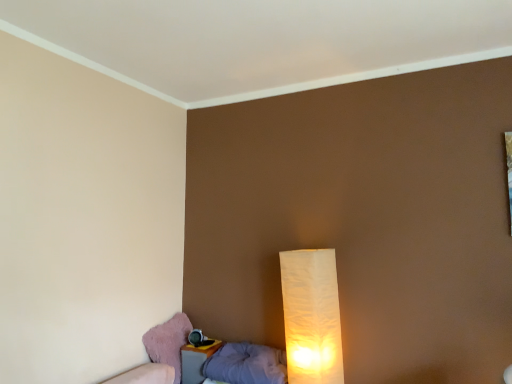
The width and height of the screenshot is (512, 384). What do you see at coordinates (168, 342) in the screenshot?
I see `pink fabric swivel chair at lower left` at bounding box center [168, 342].

This screenshot has width=512, height=384. What do you see at coordinates (311, 316) in the screenshot? I see `white paper lamp at lower right` at bounding box center [311, 316].

What are the coordinates of `gray fabric pillow at lower left` in the screenshot? It's located at (246, 364).

At what (x,y) coordinates should I click in order to perform the action: click on matte plastic nightstand at lower left. Please return your answer as a coordinate pair (x, y). Looking at the image, I should click on (196, 361).

Is pink fabric swivel chair at lower left positioned far away from white paper lamp at lower right?

No, pink fabric swivel chair at lower left is in close proximity to white paper lamp at lower right.

Does pink fabric swivel chair at lower left lie behind white paper lamp at lower right?

Yes, pink fabric swivel chair at lower left is further from the viewer.

Can you confirm if pink fabric swivel chair at lower left is bigger than white paper lamp at lower right?

No.

Is point (160, 356) closer or farther from the camera than point (286, 379)?

Clearly, point (160, 356) is more distant from the camera than point (286, 379).

Which of these two, pink fabric swivel chair at lower left or gray fabric pillow at lower left, is bigger?

Bigger between the two is gray fabric pillow at lower left.

Is pink fabric swivel chair at lower left positioned behind gray fabric pillow at lower left?

Yes, it is behind gray fabric pillow at lower left.

Considering the relative sizes of pink fabric swivel chair at lower left and gray fabric pillow at lower left in the image provided, is pink fabric swivel chair at lower left taller than gray fabric pillow at lower left?

Yes.

Which is less distant, (176, 348) or (197, 379)?

Point (176, 348).

Between pink fabric swivel chair at lower left and matte plastic nightstand at lower left, which one has larger width?

Wider between the two is pink fabric swivel chair at lower left.

Is matte plastic nightstand at lower left located within pink fabric swivel chair at lower left?

No, pink fabric swivel chair at lower left does not contain matte plastic nightstand at lower left.

Considering the relative sizes of pink fabric swivel chair at lower left and matte plastic nightstand at lower left in the image provided, is pink fabric swivel chair at lower left bigger than matte plastic nightstand at lower left?

Indeed, pink fabric swivel chair at lower left has a larger size compared to matte plastic nightstand at lower left.

This screenshot has height=384, width=512. Identify the location of swivel chair that appears below the white paper lamp at lower right (from a real-world perspective). (168, 342).

Is white paper lamp at lower right wider than pink fabric swivel chair at lower left?

No, white paper lamp at lower right is not wider than pink fabric swivel chair at lower left.

Consider the image. In the image, is white paper lamp at lower right positioned in front of or behind pink fabric swivel chair at lower left?

Clearly, white paper lamp at lower right is in front of pink fabric swivel chair at lower left.

Between matte plastic nightstand at lower left and gray fabric pillow at lower left, which one is positioned in front?

gray fabric pillow at lower left is in front.

From the image's perspective, would you say matte plastic nightstand at lower left is positioned over gray fabric pillow at lower left?

No, from the image's perspective, matte plastic nightstand at lower left is not above gray fabric pillow at lower left.

Is matte plastic nightstand at lower left oriented away from gray fabric pillow at lower left?

No.

Is gray fabric pillow at lower left looking in the opposite direction of white paper lamp at lower right?

gray fabric pillow at lower left does not have its back to white paper lamp at lower right.

Between point (275, 381) and point (280, 261), which one is positioned in front?

Point (275, 381)

Where is `pillow that is behind the white paper lamp at lower right`? Image resolution: width=512 pixels, height=384 pixels. pillow that is behind the white paper lamp at lower right is located at coordinates (246, 364).

From the image's perspective, who appears lower, gray fabric pillow at lower left or white paper lamp at lower right?

gray fabric pillow at lower left, from the image's perspective.

Between white paper lamp at lower right and gray fabric pillow at lower left, which one has larger width?

gray fabric pillow at lower left is wider.

From a real-world perspective, is white paper lamp at lower right located beneath gray fabric pillow at lower left?

No.

Choose the correct answer: Is white paper lamp at lower right inside gray fabric pillow at lower left or outside it?

white paper lamp at lower right is located beyond the bounds of gray fabric pillow at lower left.

The height and width of the screenshot is (384, 512). In order to click on lamp that is in front of the pink fabric swivel chair at lower left in this screenshot , I will do `click(311, 316)`.

The image size is (512, 384). What are the coordinates of `swivel chair behind the gray fabric pillow at lower left` in the screenshot? It's located at (168, 342).

Looking at the image, which one is located further to gray fabric pillow at lower left, pink fabric swivel chair at lower left or matte plastic nightstand at lower left?

pink fabric swivel chair at lower left.

When comparing their distances from white paper lamp at lower right, does gray fabric pillow at lower left or pink fabric swivel chair at lower left seem closer?

gray fabric pillow at lower left.

Which object lies nearer to the anchor point matte plastic nightstand at lower left, gray fabric pillow at lower left or pink fabric swivel chair at lower left?

The object closer to matte plastic nightstand at lower left is pink fabric swivel chair at lower left.

Based on the photo, when comparing their distances from matte plastic nightstand at lower left, does white paper lamp at lower right or pink fabric swivel chair at lower left seem closer?

Among the two, pink fabric swivel chair at lower left is located nearer to matte plastic nightstand at lower left.

Which object lies nearer to the anchor point pink fabric swivel chair at lower left, white paper lamp at lower right or gray fabric pillow at lower left?

Based on the image, gray fabric pillow at lower left appears to be nearer to pink fabric swivel chair at lower left.

When comparing their distances from gray fabric pillow at lower left, does white paper lamp at lower right or matte plastic nightstand at lower left seem further?

Based on the image, white paper lamp at lower right appears to be further to gray fabric pillow at lower left.

Estimate the real-world distances between objects in this image. Which object is closer to matte plastic nightstand at lower left, white paper lamp at lower right or gray fabric pillow at lower left?

gray fabric pillow at lower left is positioned closer to the anchor matte plastic nightstand at lower left.

Which object lies further to the anchor point pink fabric swivel chair at lower left, white paper lamp at lower right or matte plastic nightstand at lower left?

The object further to pink fabric swivel chair at lower left is white paper lamp at lower right.

Find the location of `pillow between matte plastic nightstand at lower left and white paper lamp at lower right in the horizontal direction`. pillow between matte plastic nightstand at lower left and white paper lamp at lower right in the horizontal direction is located at coordinates (246, 364).

Where is `pillow between pink fabric swivel chair at lower left and white paper lamp at lower right in the horizontal direction`? This screenshot has height=384, width=512. pillow between pink fabric swivel chair at lower left and white paper lamp at lower right in the horizontal direction is located at coordinates (246, 364).

You are a GUI agent. You are given a task and a screenshot of the screen. Output one action in this format:
    pyautogui.click(x=<x>, y=<y>)
    Task: Click on the nightstand situated between pink fabric swivel chair at lower left and gray fabric pillow at lower left from left to right
    This screenshot has height=384, width=512.
    Given the screenshot: What is the action you would take?
    pyautogui.click(x=196, y=361)

Find the location of a particular element. nightstand between pink fabric swivel chair at lower left and white paper lamp at lower right is located at coordinates tap(196, 361).